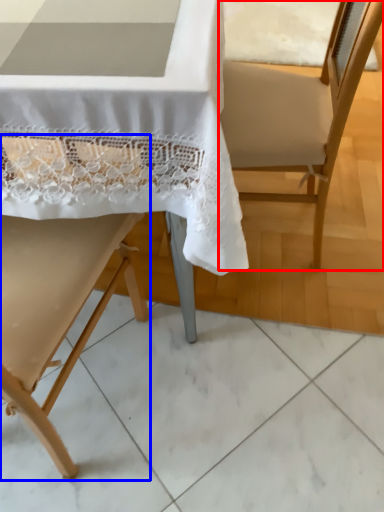
Question: Which point is closer to the camera, armchair (highlighted by a red box) or chair (highlighted by a blue box)?

Choices:
 (A) armchair
 (B) chair

Answer: (B)